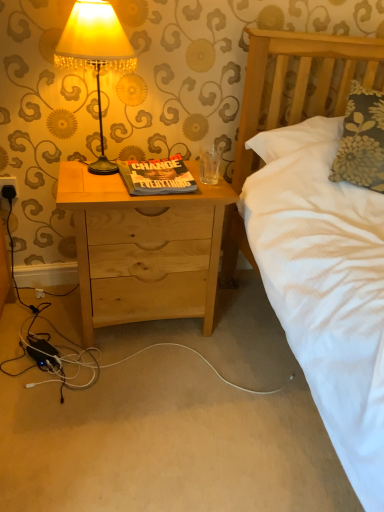
The height and width of the screenshot is (512, 384). What do you see at coordinates (8, 188) in the screenshot?
I see `black plastic electric outlet at lower left` at bounding box center [8, 188].

Where is `matte yellow fabric lampshade at upper left`? The image size is (384, 512). matte yellow fabric lampshade at upper left is located at coordinates (95, 54).

Measure the distance between natural wood nightstand at center and camera.

A distance of 1.27 meters exists between natural wood nightstand at center and camera.

Where is `black plastic electric outlet at lower left`? The height and width of the screenshot is (512, 384). black plastic electric outlet at lower left is located at coordinates (8, 188).

Does matte yellow fabric lampshade at upper left lie behind black plastic electric outlet at lower left?

No, matte yellow fabric lampshade at upper left is in front of black plastic electric outlet at lower left.

Looking at this image, from a real-world perspective, between matte yellow fabric lampshade at upper left and black plastic electric outlet at lower left, who is vertically higher?

matte yellow fabric lampshade at upper left is physically above.

From the image's perspective, is matte yellow fabric lampshade at upper left positioned above or below black plastic electric outlet at lower left?

Clearly, from the image's perspective, matte yellow fabric lampshade at upper left is above black plastic electric outlet at lower left.

Are natural wood nightstand at center and matte yellow fabric lampshade at upper left beside each other?

No, natural wood nightstand at center is not beside matte yellow fabric lampshade at upper left.

From the image's perspective, which is below, natural wood nightstand at center or matte yellow fabric lampshade at upper left?

natural wood nightstand at center, from the image's perspective.

Measure the distance between natural wood nightstand at center and matte yellow fabric lampshade at upper left.

The distance of natural wood nightstand at center from matte yellow fabric lampshade at upper left is 13.41 inches.

In order to click on nightstand that appears below the matte yellow fabric lampshade at upper left (from the image's perspective) in this screenshot , I will do `click(143, 249)`.

How different are the orientations of black plastic electric outlet at lower left and matte yellow fabric lampshade at upper left in degrees?

The angle between the facing direction of black plastic electric outlet at lower left and the facing direction of matte yellow fabric lampshade at upper left is 1.74 degrees.

Is matte yellow fabric lampshade at upper left at the back of black plastic electric outlet at lower left?

No.

Does black plastic electric outlet at lower left have a greater height compared to matte yellow fabric lampshade at upper left?

No, black plastic electric outlet at lower left is not taller than matte yellow fabric lampshade at upper left.

Which of these two, black plastic electric outlet at lower left or matte yellow fabric lampshade at upper left, is bigger?

matte yellow fabric lampshade at upper left is bigger.

Which of these two, matte yellow fabric lampshade at upper left or natural wood nightstand at center, is thinner?

matte yellow fabric lampshade at upper left is thinner.

Can you tell me how much matte yellow fabric lampshade at upper left and natural wood nightstand at center differ in facing direction?

They differ by 0.789 degrees in their facing directions.

From a real-world perspective, between matte yellow fabric lampshade at upper left and natural wood nightstand at center, who is vertically lower?

natural wood nightstand at center, from a real-world perspective.

Is matte yellow fabric lampshade at upper left facing towards natural wood nightstand at center?

No, matte yellow fabric lampshade at upper left is not oriented towards natural wood nightstand at center.

What's the angular difference between natural wood nightstand at center and black plastic electric outlet at lower left's facing directions?

The facing directions of natural wood nightstand at center and black plastic electric outlet at lower left are 0.946 degrees apart.

From the image's perspective, would you say natural wood nightstand at center is positioned over black plastic electric outlet at lower left?

No, from the image's perspective, natural wood nightstand at center is not above black plastic electric outlet at lower left.

Looking at this image, is natural wood nightstand at center directly adjacent to black plastic electric outlet at lower left?

natural wood nightstand at center and black plastic electric outlet at lower left are clearly separated.

From a real-world perspective, is natural wood nightstand at center under black plastic electric outlet at lower left?

Yes.

Is black plastic electric outlet at lower left positioned before natural wood nightstand at center?

No, the depth of black plastic electric outlet at lower left is greater than that of natural wood nightstand at center.

Considering the positions of objects black plastic electric outlet at lower left and natural wood nightstand at center in the image provided, who is more to the left, black plastic electric outlet at lower left or natural wood nightstand at center?

black plastic electric outlet at lower left.

Is black plastic electric outlet at lower left inside the boundaries of natural wood nightstand at center, or outside?

black plastic electric outlet at lower left is located beyond the bounds of natural wood nightstand at center.

Is black plastic electric outlet at lower left facing towards natural wood nightstand at center?

No, black plastic electric outlet at lower left does not turn towards natural wood nightstand at center.

Find the location of a particular element. The width and height of the screenshot is (384, 512). lamp located above the black plastic electric outlet at lower left (from a real-world perspective) is located at coordinates (95, 54).

At what (x,y) coordinates should I click in order to perform the action: click on nightstand lying below the matte yellow fabric lampshade at upper left (from the image's perspective). Please return your answer as a coordinate pair (x, y). The height and width of the screenshot is (512, 384). Looking at the image, I should click on (143, 249).

Looking at the image, which one is located closer to black plastic electric outlet at lower left, natural wood nightstand at center or matte yellow fabric lampshade at upper left?

matte yellow fabric lampshade at upper left is closer to black plastic electric outlet at lower left.

In the scene shown: From the image, which object appears to be nearer to matte yellow fabric lampshade at upper left, black plastic electric outlet at lower left or natural wood nightstand at center?

natural wood nightstand at center is closer to matte yellow fabric lampshade at upper left.

When comparing their distances from matte yellow fabric lampshade at upper left, does natural wood nightstand at center or black plastic electric outlet at lower left seem further?

black plastic electric outlet at lower left is further to matte yellow fabric lampshade at upper left.

Which object lies further to the anchor point black plastic electric outlet at lower left, matte yellow fabric lampshade at upper left or natural wood nightstand at center?

Among the two, natural wood nightstand at center is located further to black plastic electric outlet at lower left.

Looking at the image, which one is located closer to natural wood nightstand at center, matte yellow fabric lampshade at upper left or black plastic electric outlet at lower left?

matte yellow fabric lampshade at upper left lies closer to natural wood nightstand at center than the other object.

Based on their spatial positions, is black plastic electric outlet at lower left or matte yellow fabric lampshade at upper left further from natural wood nightstand at center?

black plastic electric outlet at lower left.

Identify the location of lamp between black plastic electric outlet at lower left and natural wood nightstand at center from left to right. (95, 54).